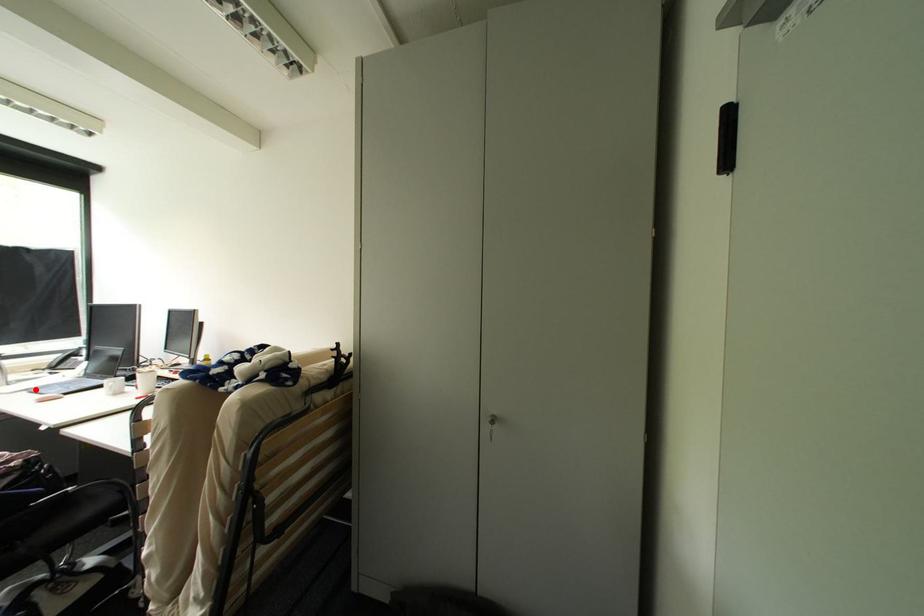
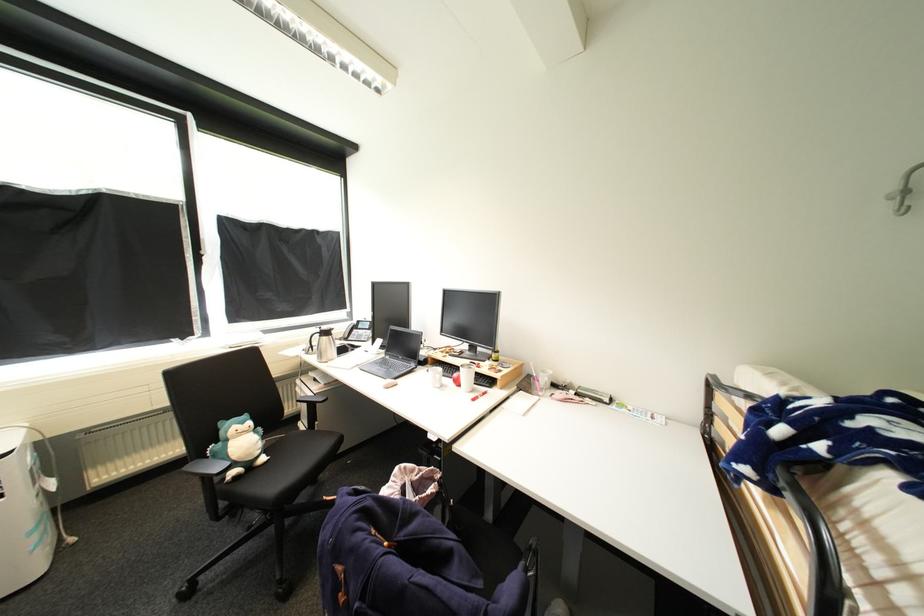
In the second image, find the point that corresponds to the highlighted location in the first image.

(363, 366)